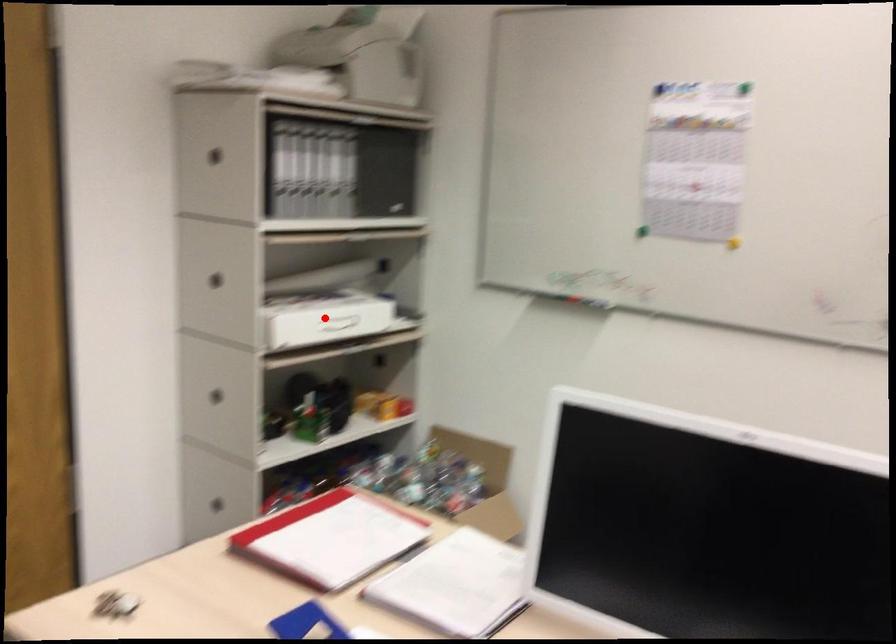
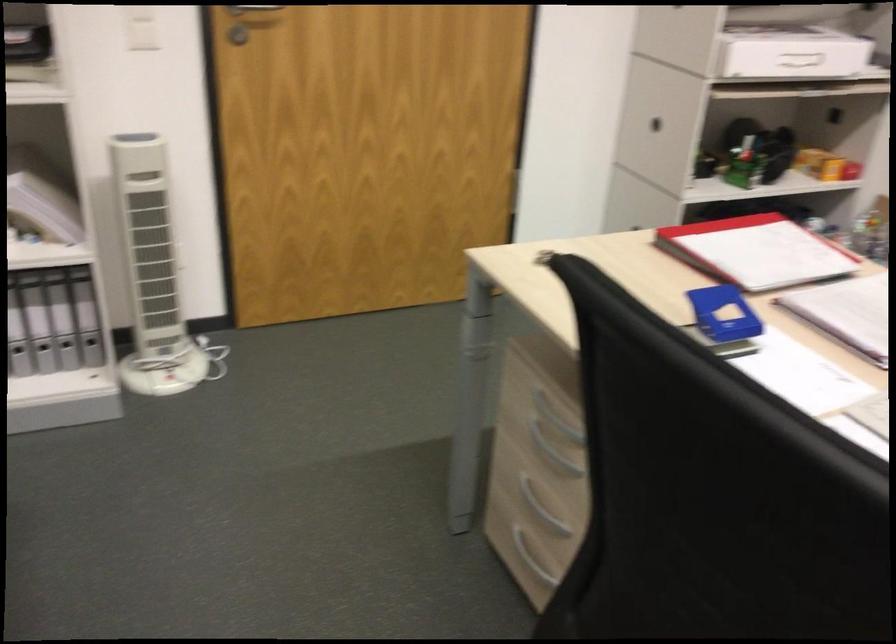
Where in the second image is the point corresponding to the highlighted location from the first image?

(790, 53)